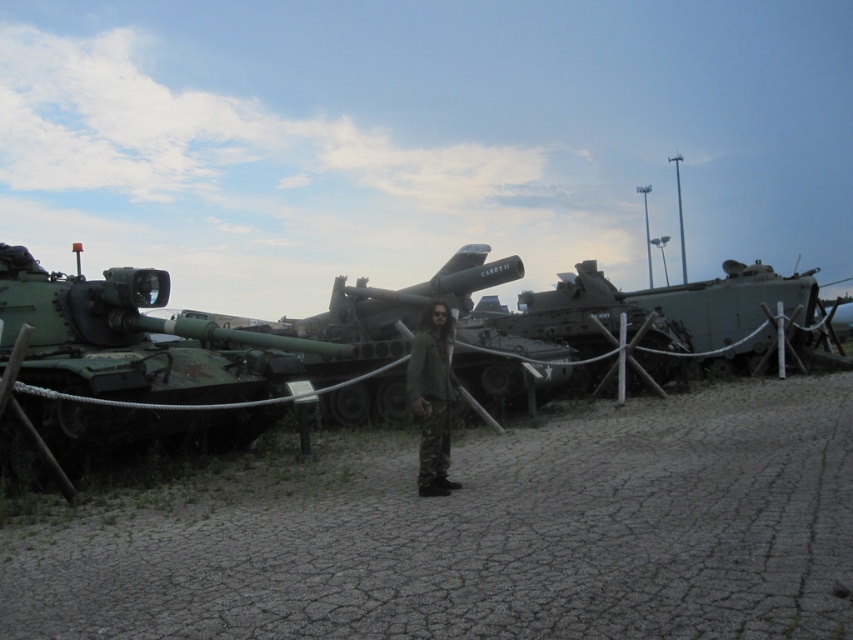
Can you confirm if dirt field at center is thinner than green camouflage pants at center?

No, dirt field at center is not thinner than green camouflage pants at center.

Does point (543, 497) come farther from viewer compared to point (424, 376)?

No.

The image size is (853, 640). What do you see at coordinates (488, 538) in the screenshot?
I see `dirt field at center` at bounding box center [488, 538].

I want to click on dirt field at center, so click(488, 538).

What do you see at coordinates (654, 308) in the screenshot? I see `green camouflage tank at center` at bounding box center [654, 308].

Does green camouflage tank at center appear on the left side of green matte tank at center?

In fact, green camouflage tank at center is to the right of green matte tank at center.

Between point (717, 292) and point (421, 285), which one is positioned in front?

Point (421, 285) is in front.

At what (x,y) coordinates should I click in order to perform the action: click on green camouflage tank at center. Please return your answer as a coordinate pair (x, y). The image size is (853, 640). Looking at the image, I should click on (654, 308).

Does green camouflage tank at center have a smaller size compared to green camouflage pants at center?

No, green camouflage tank at center is not smaller than green camouflage pants at center.

Can you confirm if green camouflage tank at center is taller than green camouflage pants at center?

Correct, green camouflage tank at center is much taller as green camouflage pants at center.

Between point (694, 337) and point (436, 467), which one is positioned in front?

Point (436, 467) is more forward.

At what (x,y) coordinates should I click in order to perform the action: click on green camouflage tank at center. Please return your answer as a coordinate pair (x, y). Looking at the image, I should click on (654, 308).